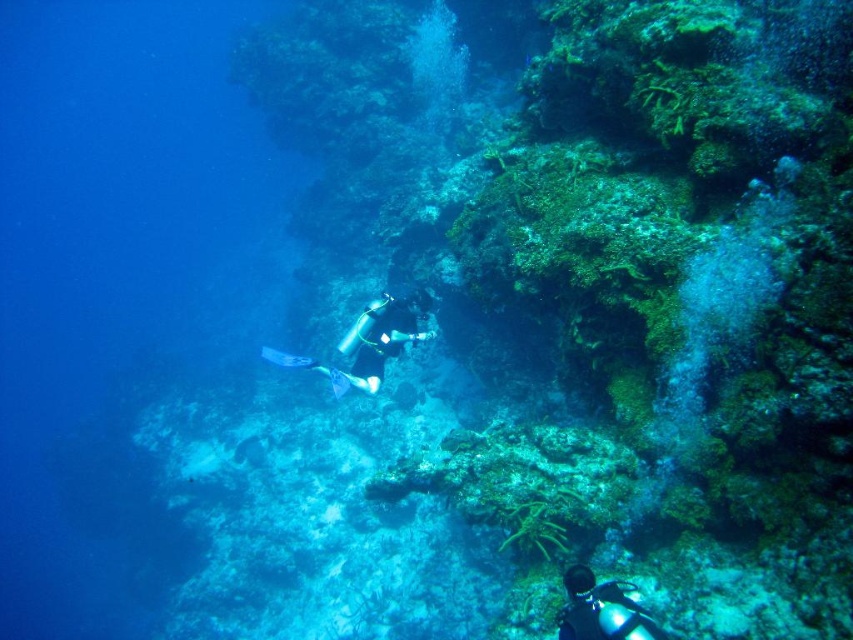
Question: Does black matte scuba diver at center appear over glossy blue diving suit at lower right?

Choices:
 (A) yes
 (B) no

Answer: (A)

Question: Which object is closer to the camera taking this photo?

Choices:
 (A) black matte scuba diver at center
 (B) glossy blue diving suit at lower right

Answer: (B)

Question: Does black matte scuba diver at center have a larger size compared to glossy blue diving suit at lower right?

Choices:
 (A) yes
 (B) no

Answer: (A)

Question: Does black matte scuba diver at center have a smaller size compared to glossy blue diving suit at lower right?

Choices:
 (A) yes
 (B) no

Answer: (B)